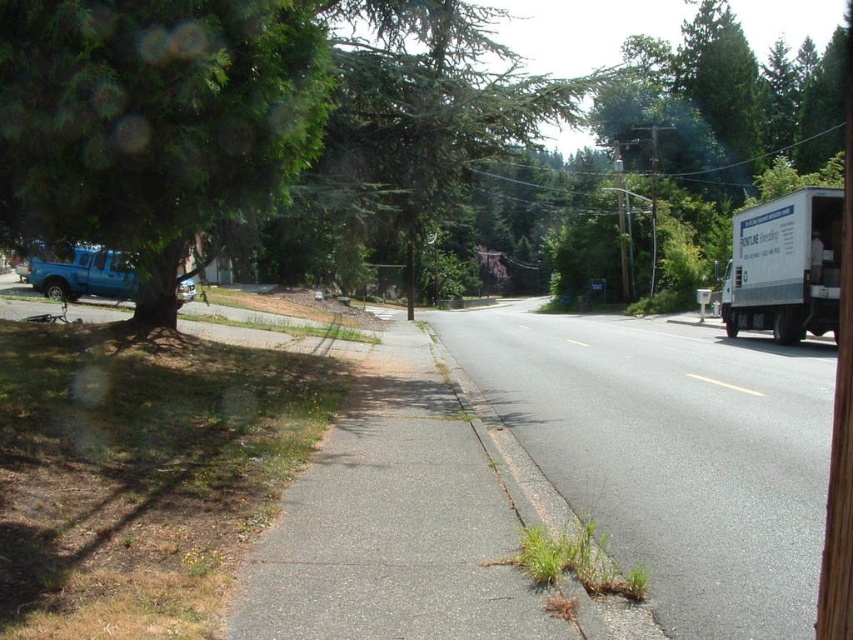
Question: Can you confirm if white matte truck at right is wider than matte blue truck at left?

Choices:
 (A) yes
 (B) no

Answer: (B)

Question: Considering the relative positions of gray asphalt sidewalk at center and white matte truck at right in the image provided, where is gray asphalt sidewalk at center located with respect to white matte truck at right?

Choices:
 (A) above
 (B) below

Answer: (B)

Question: Can you confirm if green leafy tree at upper left is smaller than matte blue truck at left?

Choices:
 (A) no
 (B) yes

Answer: (A)

Question: Which point is closer to the camera taking this photo?

Choices:
 (A) (386, 204)
 (B) (90, 252)
 (C) (175, 109)

Answer: (C)

Question: Among these objects, which one is farthest from the camera?

Choices:
 (A) green leafy tree at upper left
 (B) gray asphalt road at center
 (C) gray asphalt sidewalk at center

Answer: (A)

Question: Which object is the closest to the white matte truck at right?

Choices:
 (A) green leafy tree at left
 (B) gray asphalt sidewalk at center
 (C) matte blue truck at left

Answer: (B)